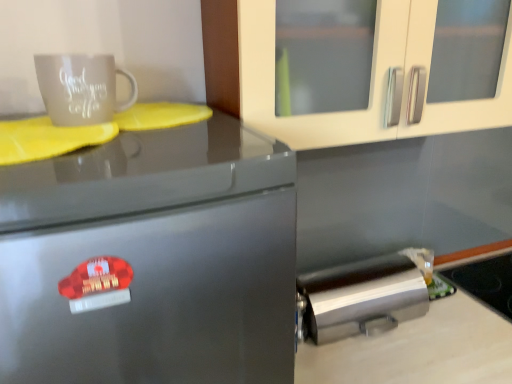
In the scene shown: Measure the distance between brushed metal trash can at lower right and camera.

brushed metal trash can at lower right and camera are 3.85 feet apart from each other.

Where is `smooth white countertop at lower right`? smooth white countertop at lower right is located at coordinates (419, 349).

Describe the element at coordinates (419, 349) in the screenshot. I see `smooth white countertop at lower right` at that location.

At what (x,y) coordinates should I click in order to perform the action: click on brushed metal trash can at lower right. Please return your answer as a coordinate pair (x, y). Image resolution: width=512 pixels, height=384 pixels. Looking at the image, I should click on (362, 295).

Which is closer to the camera, [106,55] or [461,281]?

The point [106,55] is in front.

Find the location of `appliance on the right of matte ceramic mug at upper left`. appliance on the right of matte ceramic mug at upper left is located at coordinates (486, 282).

Between matte ceramic mug at upper left and glassy black stove at lower right, which one has smaller size?

Answer: matte ceramic mug at upper left.

Is there a large distance between matte ceramic mug at upper left and glassy black stove at lower right?

matte ceramic mug at upper left is far away from glassy black stove at lower right.

From a real-world perspective, does glassy black stove at lower right stand above satin silver fridge at left?

No, from a real-world perspective, glassy black stove at lower right is not on top of satin silver fridge at left.

This screenshot has width=512, height=384. What are the coordinates of `appliance on the right side of satin silver fridge at left` in the screenshot? It's located at (486, 282).

Could you tell me if glassy black stove at lower right is facing satin silver fridge at left?

No, glassy black stove at lower right is not oriented towards satin silver fridge at left.

Considering the positions of objects smooth white countertop at lower right and satin silver fridge at left in the image provided, who is more to the right, smooth white countertop at lower right or satin silver fridge at left?

smooth white countertop at lower right.

Between point (457, 319) and point (189, 290), which one is positioned behind?

The point (457, 319) is farther from the camera.

Is glassy black stove at lower right oriented away from brushed metal trash can at lower right?

No.

From the image's perspective, is glassy black stove at lower right beneath brushed metal trash can at lower right?

Yes.

From a real-world perspective, between glassy black stove at lower right and brushed metal trash can at lower right, who is vertically lower?

From a 3D spatial view, glassy black stove at lower right is below.

Is glassy black stove at lower right not near brushed metal trash can at lower right?

No, glassy black stove at lower right is in close proximity to brushed metal trash can at lower right.

Looking at this image, what's the angular difference between satin silver fridge at left and smooth white countertop at lower right's facing directions?

They differ by 0.026 degrees in their facing directions.

Consider the image. Which of these two, satin silver fridge at left or smooth white countertop at lower right, is smaller?

Smaller between the two is satin silver fridge at left.

Is satin silver fridge at left directly adjacent to smooth white countertop at lower right?

There is a gap between satin silver fridge at left and smooth white countertop at lower right.

Measure the distance between satin silver fridge at left and smooth white countertop at lower right.

satin silver fridge at left is 26.66 inches from smooth white countertop at lower right.

In terms of size, does matte ceramic mug at upper left appear bigger or smaller than smooth white countertop at lower right?

Considering their sizes, matte ceramic mug at upper left takes up less space than smooth white countertop at lower right.

Based on the photo, are matte ceramic mug at upper left and smooth white countertop at lower right located far from each other?

matte ceramic mug at upper left is near smooth white countertop at lower right, not far away.

Which is in front, matte ceramic mug at upper left or smooth white countertop at lower right?

matte ceramic mug at upper left.

Between brushed metal trash can at lower right and matte ceramic mug at upper left, which one has less height?

matte ceramic mug at upper left is shorter.

From the image's perspective, is brushed metal trash can at lower right located above or below matte ceramic mug at upper left?

brushed metal trash can at lower right is situated lower than matte ceramic mug at upper left in the image.

Does brushed metal trash can at lower right turn towards matte ceramic mug at upper left?

No, brushed metal trash can at lower right is not aimed at matte ceramic mug at upper left.

What's the angular difference between brushed metal trash can at lower right and matte ceramic mug at upper left's facing directions?

The facing directions of brushed metal trash can at lower right and matte ceramic mug at upper left are 1.59 degrees apart.

Find the location of a particular element. appliance behind the matte ceramic mug at upper left is located at coordinates (486, 282).

This screenshot has width=512, height=384. Find the location of `appliance located on the right of satin silver fridge at left`. appliance located on the right of satin silver fridge at left is located at coordinates (486, 282).

When comparing their distances from brushed metal trash can at lower right, does glassy black stove at lower right or satin silver fridge at left seem closer?

Among the two, glassy black stove at lower right is located nearer to brushed metal trash can at lower right.

Considering their positions, is satin silver fridge at left positioned further to smooth white countertop at lower right than brushed metal trash can at lower right?

The object further to smooth white countertop at lower right is satin silver fridge at left.

Which object lies nearer to the anchor point smooth white countertop at lower right, glassy black stove at lower right or satin silver fridge at left?

Among the two, glassy black stove at lower right is located nearer to smooth white countertop at lower right.

In the scene shown: Looking at the image, which one is located further to brushed metal trash can at lower right, matte ceramic mug at upper left or smooth white countertop at lower right?

The object further to brushed metal trash can at lower right is matte ceramic mug at upper left.

Based on the photo, considering their positions, is smooth white countertop at lower right positioned closer to matte ceramic mug at upper left than brushed metal trash can at lower right?

Based on the image, brushed metal trash can at lower right appears to be nearer to matte ceramic mug at upper left.

Looking at the image, which one is located closer to satin silver fridge at left, matte ceramic mug at upper left or glassy black stove at lower right?

matte ceramic mug at upper left lies closer to satin silver fridge at left than the other object.

Considering their positions, is glassy black stove at lower right positioned further to smooth white countertop at lower right than brushed metal trash can at lower right?

glassy black stove at lower right is positioned further to the anchor smooth white countertop at lower right.

From the image, which object appears to be farther from smooth white countertop at lower right, matte ceramic mug at upper left or glassy black stove at lower right?

Among the two, matte ceramic mug at upper left is located further to smooth white countertop at lower right.

In order to click on coffee cup between satin silver fridge at left and smooth white countertop at lower right from left to right in this screenshot , I will do `click(81, 88)`.

Find the location of a particular element. This screenshot has height=384, width=512. counter top between matte ceramic mug at upper left and glassy black stove at lower right is located at coordinates (419, 349).

Where is `kitchen appliance between satin silver fridge at left and glassy black stove at lower right from left to right`? kitchen appliance between satin silver fridge at left and glassy black stove at lower right from left to right is located at coordinates (362, 295).

The width and height of the screenshot is (512, 384). Identify the location of counter top situated between satin silver fridge at left and glassy black stove at lower right from left to right. (419, 349).